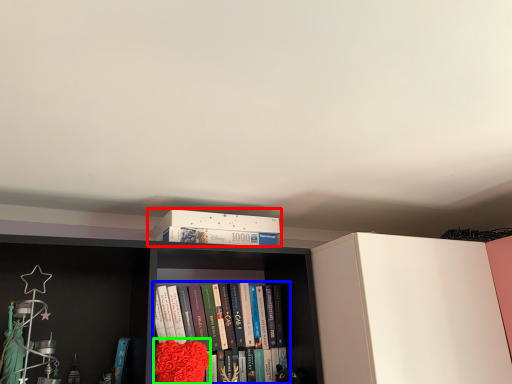
Question: Which object is positioned farthest from book cover (highlighted by a red box)? Select from book (highlighted by a blue box) and flower (highlighted by a green box).

Choices:
 (A) book
 (B) flower

Answer: (B)